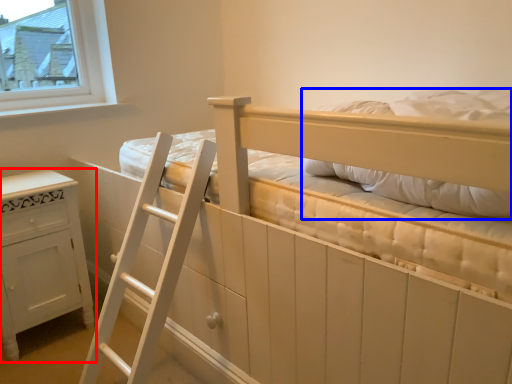
Question: Among these objects, which one is nearest to the camera, furniture (highlighted by a red box) or pillow (highlighted by a blue box)?

Choices:
 (A) furniture
 (B) pillow

Answer: (B)